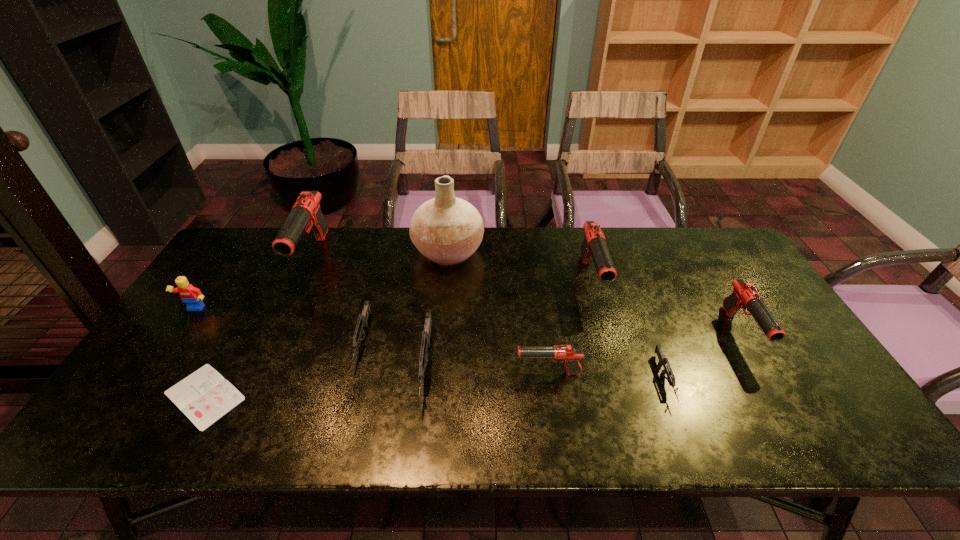
Image resolution: width=960 pixels, height=540 pixels. What are the coordinates of `vacant space located 0.230m at the aiming end of the ninth shortest object` in the screenshot? It's located at (270, 352).

You are a GUI agent. You are given a task and a screenshot of the screen. Output one action in this format:
    pyautogui.click(x=<x>, y=<y>)
    Task: Click on the vacant position located at the aiming end of the sixth shortest gun
    The image size is (960, 540).
    Given the screenshot: What is the action you would take?
    617,375

This screenshot has height=540, width=960. I want to click on free point located at the aiming end of the rightmost object, so pyautogui.click(x=801, y=435).

Locate an element on the screen. The image size is (960, 540). vacant position located on the face of the leftmost object is located at coordinates (119, 422).

The image size is (960, 540). I want to click on vacant space positioned 0.240m at the aiming end of the second black gun from left to right, so point(420,373).

The width and height of the screenshot is (960, 540). Identify the location of free space located 0.360m at the aiming end of the second black gun from left to right. (x=371, y=373).

This screenshot has height=540, width=960. I want to click on free space located 0.100m at the aiming end of the second black gun from left to right, so click(x=475, y=373).

Where is `vacant region located 0.080m aimed along the barrel of the third shortest object`? vacant region located 0.080m aimed along the barrel of the third shortest object is located at coordinates (347, 403).

Locate an element on the screen. The width and height of the screenshot is (960, 540). free point located 0.050m aimed along the barrel of the second object from right to left is located at coordinates (684, 428).

You are a GUI agent. You are given a task and a screenshot of the screen. Output one action in this format:
    pyautogui.click(x=<x>, y=<y>)
    Task: Click on the blank area located on the right of the shortest object
    
    Given the screenshot: What is the action you would take?
    (x=403, y=396)